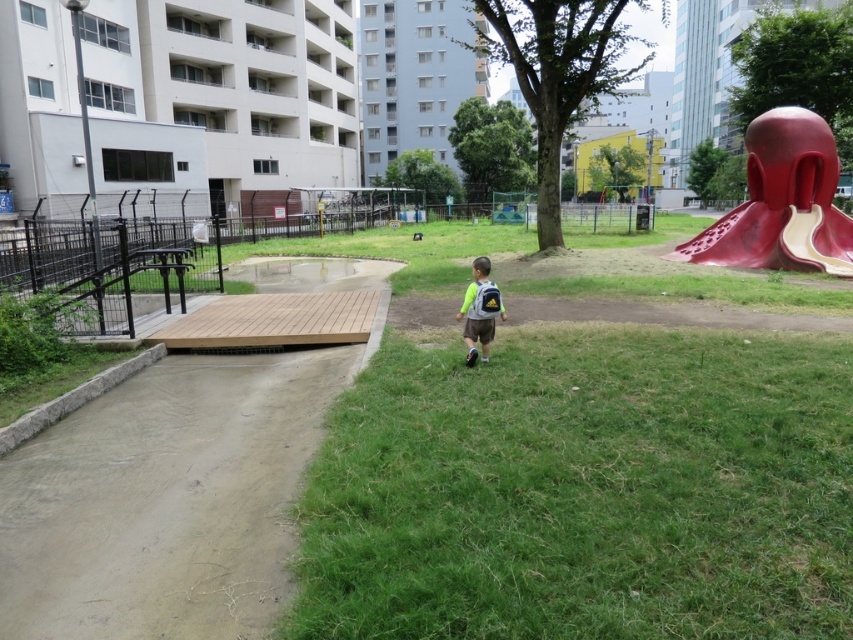
Question: Can you confirm if green grassy at lower right is positioned below light green fabric backpack at center?

Choices:
 (A) yes
 (B) no

Answer: (A)

Question: Does smooth red slide at right have a lesser width compared to light green fabric backpack at center?

Choices:
 (A) no
 (B) yes

Answer: (A)

Question: Which point is closer to the camera?

Choices:
 (A) green grassy at lower right
 (B) light green fabric backpack at center
 (C) smooth red slide at right

Answer: (A)

Question: Which object is closer to the camera taking this photo?

Choices:
 (A) smooth red slide at right
 (B) green grassy at lower right

Answer: (B)

Question: Does green grassy at lower right appear on the left side of light green fabric backpack at center?

Choices:
 (A) yes
 (B) no

Answer: (B)

Question: Which object is the farthest from the green grassy at lower right?

Choices:
 (A) smooth red slide at right
 (B) light green fabric backpack at center

Answer: (A)